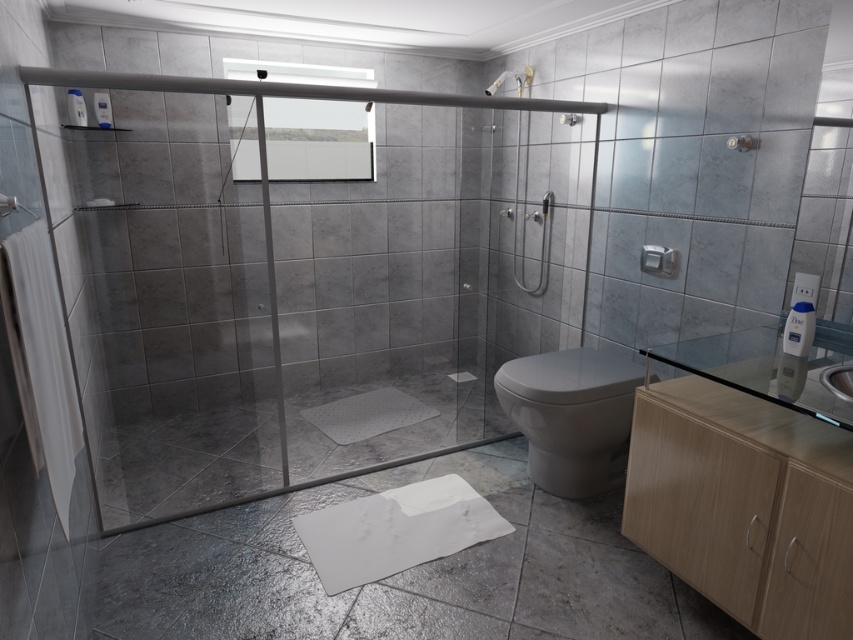
Question: Which point is closer to the camera?

Choices:
 (A) (490, 92)
 (B) (846, 380)

Answer: (B)

Question: Which of the following is the closest to the observer?

Choices:
 (A) (444, 125)
 (B) (485, 92)

Answer: (B)

Question: Is the position of white glossy toilet at lower right less distant than that of matte white shower at upper center?

Choices:
 (A) yes
 (B) no

Answer: (A)

Question: Is transparent glass shower door at center thinner than white glossy toilet at lower right?

Choices:
 (A) yes
 (B) no

Answer: (B)

Question: Estimate the real-world distances between objects in this image. Which object is closer to the matte white shower at upper center?

Choices:
 (A) light wood cabinet at lower right
 (B) white glossy sink at lower right
 (C) transparent glass shower door at center
 (D) white glossy toilet at lower right

Answer: (C)

Question: Can you confirm if light wood cabinet at lower right is wider than white glossy sink at lower right?

Choices:
 (A) no
 (B) yes

Answer: (B)